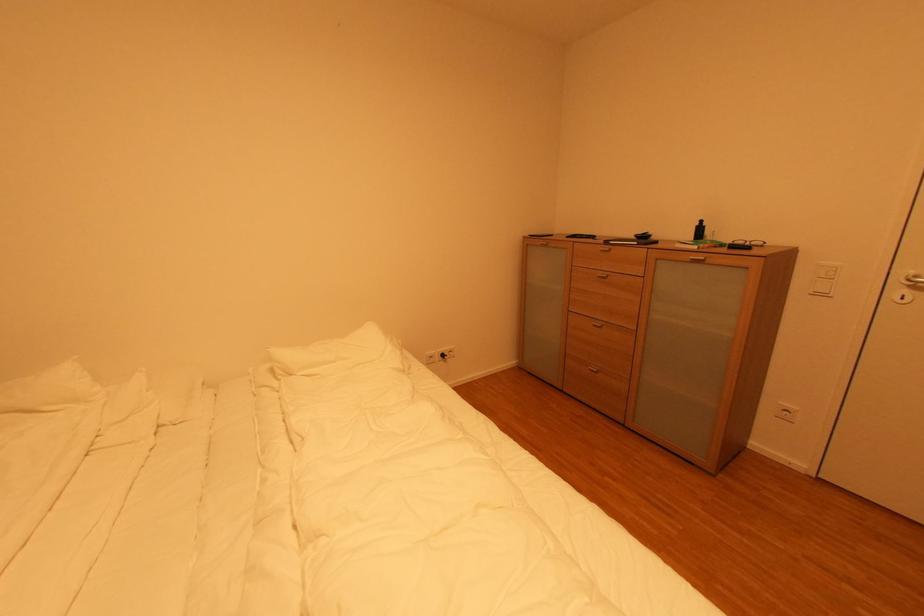
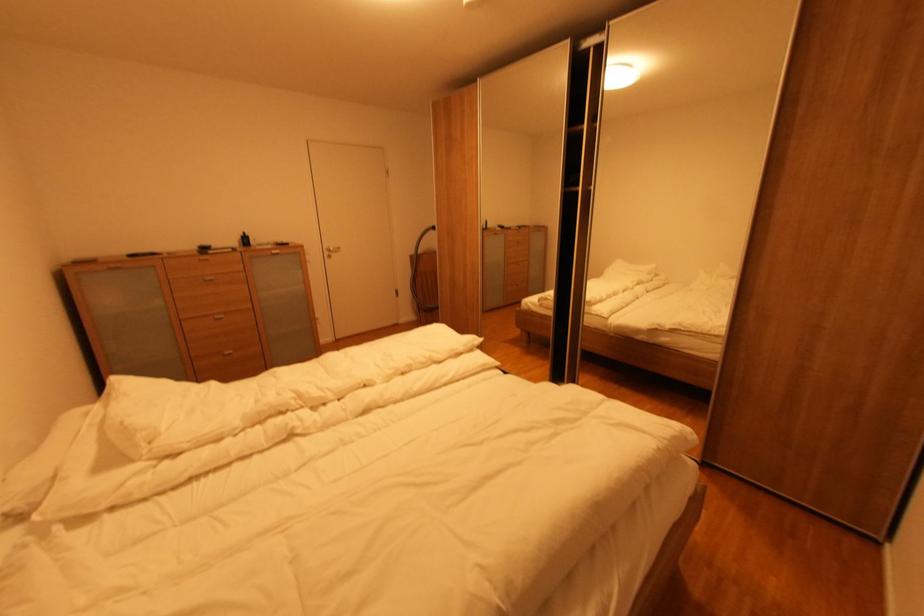
The point at [702,225] is marked in the first image. Where is the corresponding point in the second image?

(248, 237)